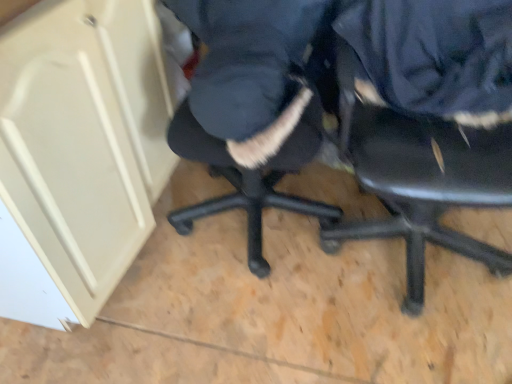
The image size is (512, 384). Find the location of `vacant space in black plastic chair at center (from a real-world perspective)`. vacant space in black plastic chair at center (from a real-world perspective) is located at coordinates (402, 249).